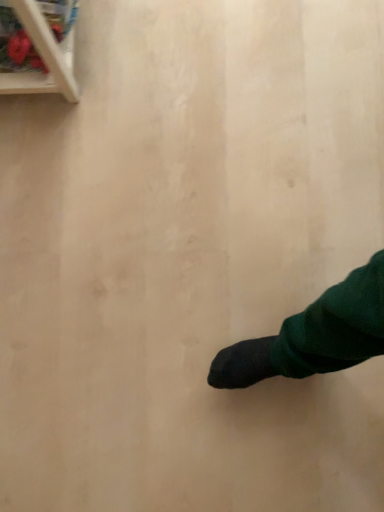
The width and height of the screenshot is (384, 512). Find the location of `wooden toy box at upper left`. wooden toy box at upper left is located at coordinates (43, 58).

Describe the element at coordinates (43, 58) in the screenshot. The height and width of the screenshot is (512, 384). I see `wooden toy box at upper left` at that location.

Locate an element on the screen. wooden toy box at upper left is located at coordinates (43, 58).